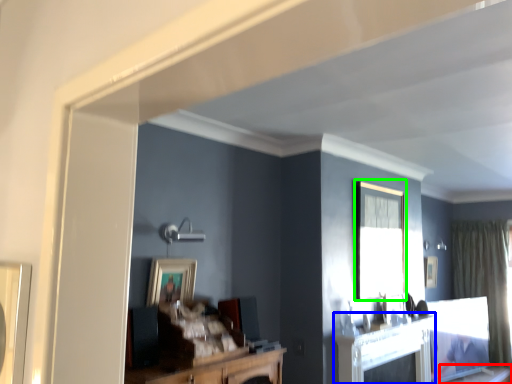
Question: Which object is the closest to the table (highlighted by a red box)? Choose among these: fireplace (highlighted by a blue box) or window (highlighted by a green box).

Choices:
 (A) fireplace
 (B) window

Answer: (A)